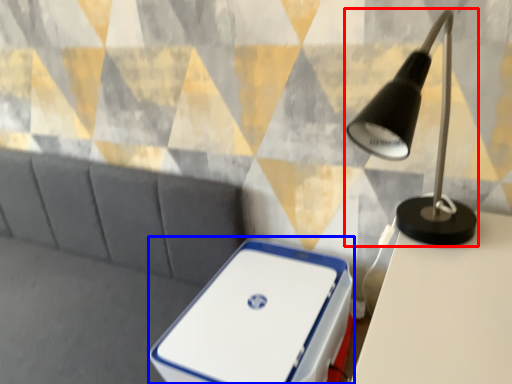
Question: Which of the following is the farthest to the observer, lamp (highlighted by a red box) or storage box (highlighted by a blue box)?

Choices:
 (A) lamp
 (B) storage box

Answer: (B)